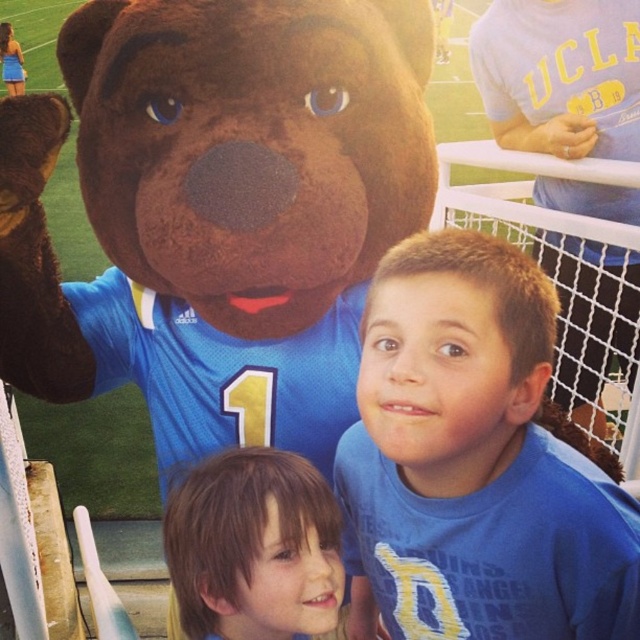
Question: Can you confirm if blue jersey at center is thinner than brown hair at center?

Choices:
 (A) no
 (B) yes

Answer: (A)

Question: Which point is closer to the camera?

Choices:
 (A) blue jersey at center
 (B) brown hair at center

Answer: (A)

Question: In this image, where is blue jersey at center located relative to brown hair at center?

Choices:
 (A) below
 (B) above

Answer: (A)

Question: Does blue jersey at center have a lesser width compared to brown hair at center?

Choices:
 (A) no
 (B) yes

Answer: (A)